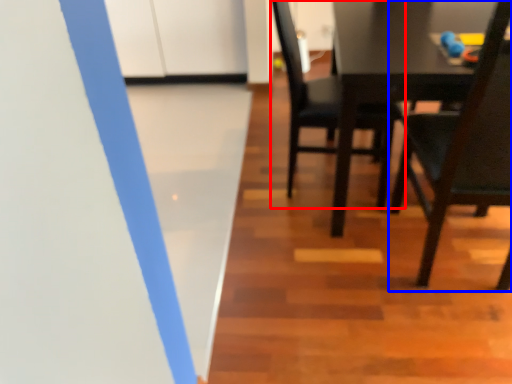
Question: Which point is further to the camera, chair (highlighted by a red box) or chair (highlighted by a blue box)?

Choices:
 (A) chair
 (B) chair

Answer: (A)